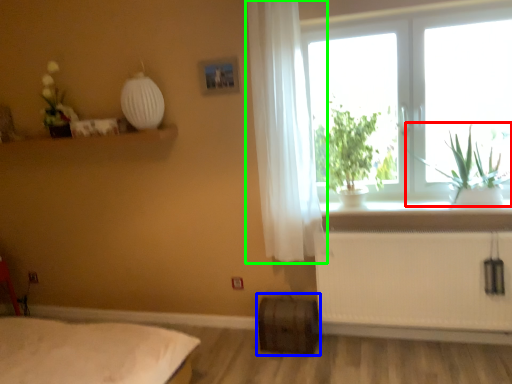
Question: Based on their relative distances, which object is farther from plant (highlighted by a red box)? Choose from window box (highlighted by a blue box) and curtain (highlighted by a green box).

Choices:
 (A) window box
 (B) curtain

Answer: (A)